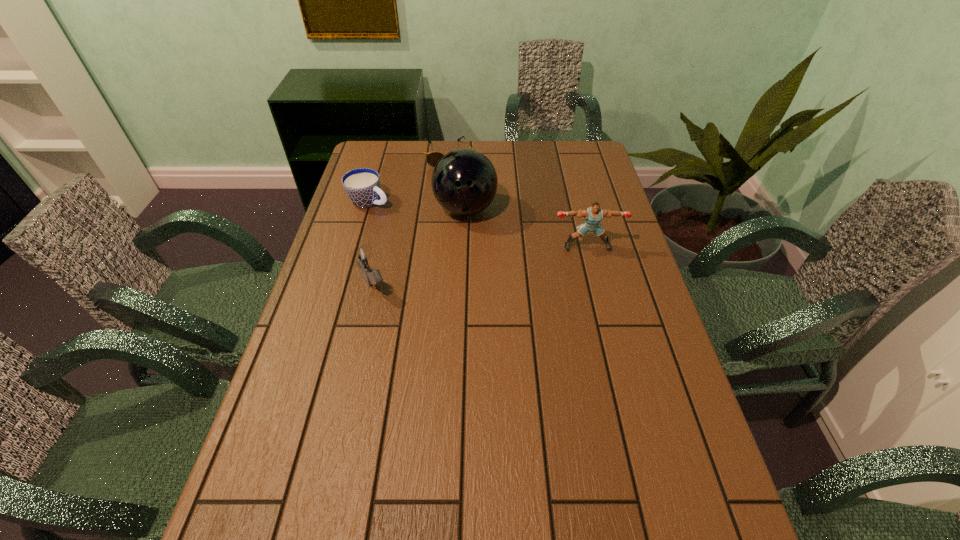
This screenshot has height=540, width=960. What are the coordinates of `vacant space positioned on the side of the second shortest object with the handle` in the screenshot? It's located at (423, 221).

Find the location of a particular element. free space located 0.190m on the side of the second shortest object with the handle is located at coordinates (433, 226).

Locate an element on the screen. Image resolution: width=960 pixels, height=540 pixels. vacant point located on the side of the second shortest object with the handle is located at coordinates [x=416, y=219].

Locate an element on the screen. vacant space situated 0.130m on the lenses of the shortest object is located at coordinates (454, 187).

Find the location of a particular element. This screenshot has height=540, width=960. free location located 0.140m on the lenses of the shortest object is located at coordinates (454, 189).

Find the location of `vacant region located 0.230m on the lenses of the shortest object`. vacant region located 0.230m on the lenses of the shortest object is located at coordinates (457, 204).

At what (x,y) coordinates should I click in order to perform the action: click on vacant space located on the side of the tallest object with the finger holes. Please return your answer as a coordinate pair (x, y). The image size is (960, 540). Looking at the image, I should click on (493, 310).

At what (x,y) coordinates should I click in order to perform the action: click on free space located 0.140m on the side of the tallest object with the finger holes. Please return your answer as a coordinate pair (x, y). The image size is (960, 540). Looking at the image, I should click on (479, 259).

Identify the location of free location located on the side of the tallest object with the finger holes. This screenshot has height=540, width=960. (483, 271).

The image size is (960, 540). Find the location of `object located in the far edge section of the desktop`. object located in the far edge section of the desktop is located at coordinates (432, 158).